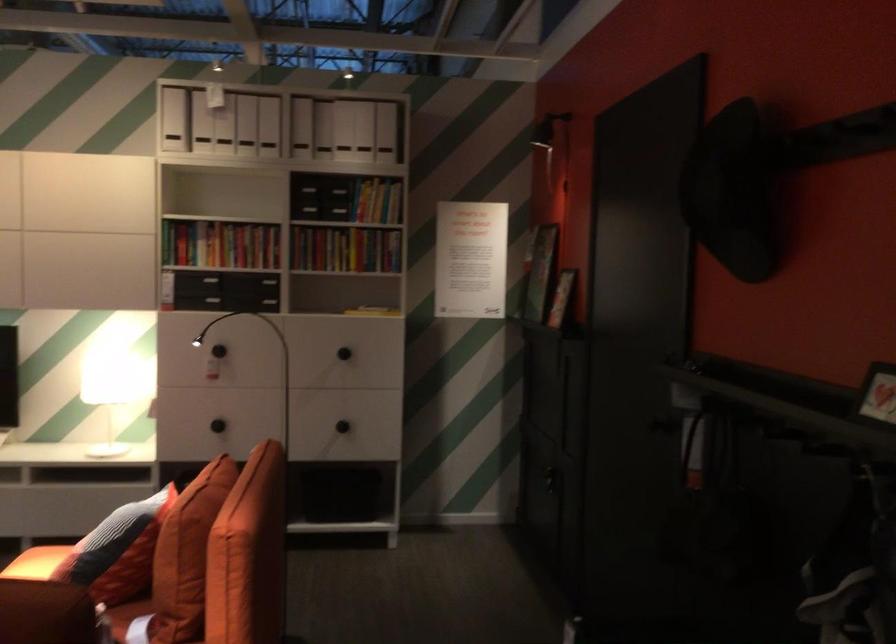
Find where to push the black lamp head. Please return your answer as a coordinate pair (x, y).

(547, 129)